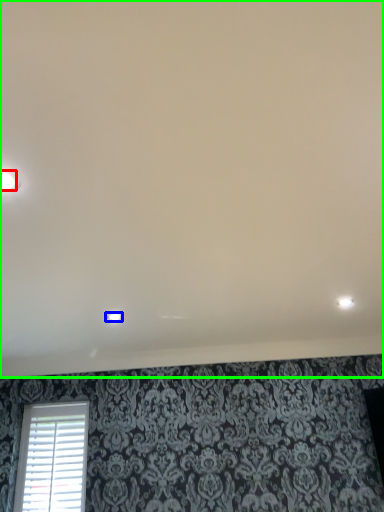
Question: Which is nearer to the dot (highlighted by a red box)? dot (highlighted by a blue box) or backdrop (highlighted by a green box).

Choices:
 (A) dot
 (B) backdrop

Answer: (B)